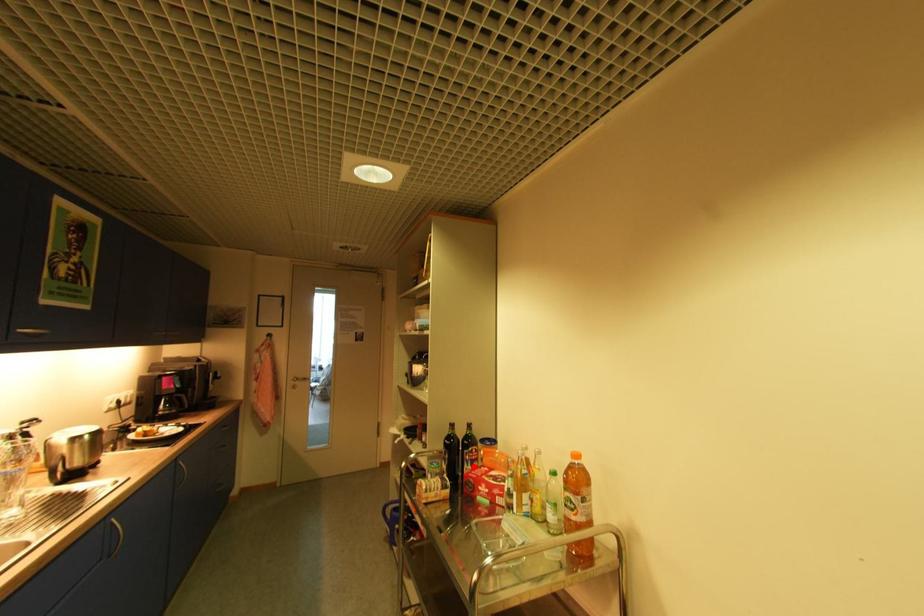
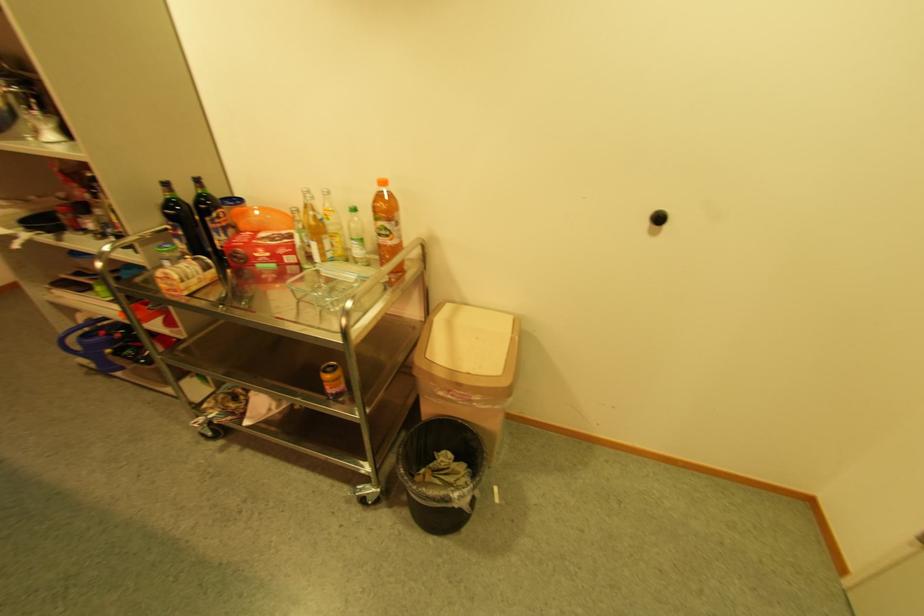
Question: I am providing you with two images of the same scene from different viewpoints. In image1, a red point is highlighted. Considering the same 3D point in image2, which of the following is correct?

Choices:
 (A) It is closer
 (B) It is farther

Answer: (A)